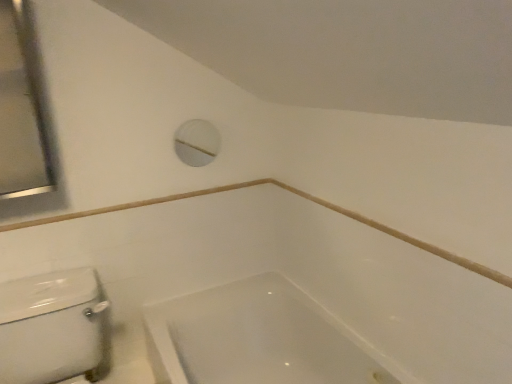
Question: Considering the relative positions of white plastic porthole at upper center and satin silver mirror at upper left in the image provided, is white plastic porthole at upper center to the right of satin silver mirror at upper left from the viewer's perspective?

Choices:
 (A) no
 (B) yes

Answer: (B)

Question: Considering the relative positions of white plastic porthole at upper center and satin silver mirror at upper left in the image provided, is white plastic porthole at upper center in front of satin silver mirror at upper left?

Choices:
 (A) no
 (B) yes

Answer: (A)

Question: Is white plastic porthole at upper center turned away from satin silver mirror at upper left?

Choices:
 (A) yes
 (B) no

Answer: (B)

Question: Is satin silver mirror at upper left a part of white plastic porthole at upper center?

Choices:
 (A) no
 (B) yes

Answer: (A)

Question: Can we say white plastic porthole at upper center lies outside satin silver mirror at upper left?

Choices:
 (A) yes
 (B) no

Answer: (A)

Question: Is satin silver mirror at upper left taller or shorter than white glossy bathtub at lower center?

Choices:
 (A) tall
 (B) short

Answer: (A)

Question: Which is correct: satin silver mirror at upper left is inside white glossy bathtub at lower center, or outside of it?

Choices:
 (A) outside
 (B) inside

Answer: (A)

Question: Is satin silver mirror at upper left in front of or behind white glossy bathtub at lower center in the image?

Choices:
 (A) front
 (B) behind

Answer: (B)

Question: Considering the positions of point (18, 187) and point (230, 362), is point (18, 187) closer or farther from the camera than point (230, 362)?

Choices:
 (A) farther
 (B) closer

Answer: (B)

Question: Considering the positions of satin silver mirror at upper left and white plastic porthole at upper center in the image, is satin silver mirror at upper left wider or thinner than white plastic porthole at upper center?

Choices:
 (A) wide
 (B) thin

Answer: (A)

Question: Based on their sizes in the image, would you say satin silver mirror at upper left is bigger or smaller than white plastic porthole at upper center?

Choices:
 (A) big
 (B) small

Answer: (A)

Question: Considering the positions of satin silver mirror at upper left and white plastic porthole at upper center in the image, is satin silver mirror at upper left taller or shorter than white plastic porthole at upper center?

Choices:
 (A) short
 (B) tall

Answer: (B)

Question: Which is correct: satin silver mirror at upper left is inside white plastic porthole at upper center, or outside of it?

Choices:
 (A) inside
 (B) outside

Answer: (B)

Question: Would you say white glossy bathtub at lower center is to the left or to the right of satin silver mirror at upper left in the picture?

Choices:
 (A) right
 (B) left

Answer: (A)

Question: In terms of width, does white glossy bathtub at lower center look wider or thinner when compared to satin silver mirror at upper left?

Choices:
 (A) thin
 (B) wide

Answer: (B)